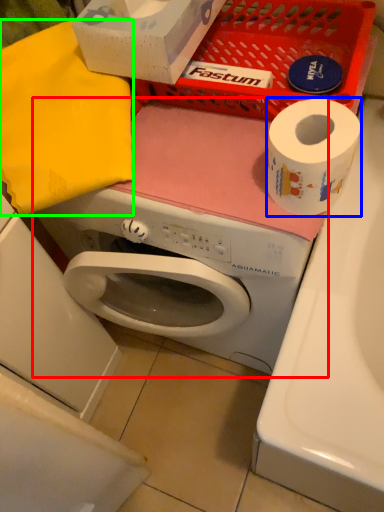
Question: Which is farther away from washing machine (highlighted by a red box)? toilet paper (highlighted by a blue box) or clothe (highlighted by a green box)?

Choices:
 (A) toilet paper
 (B) clothe

Answer: (A)